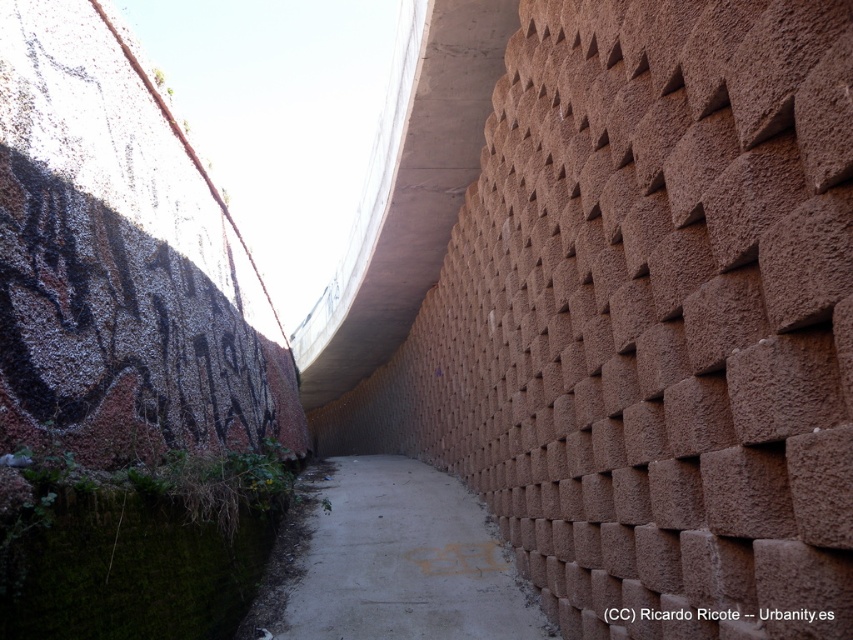
You are standing in the alleyway and want to identify the material of the wall at the point labeled as point [407,189]. Based on the scene description, what material is present at this location?

The point [407,189] indicates concrete at upper center, so the material at that location is concrete.

You are standing in the alleyway and want to move from the point at coordinates (416, 301) to the point at (384, 464). Which direction should you face to walk towards the second point?

You should face towards the direction of point (384, 464), which is behind point (416, 301). Since point (416, 301) is in front of point (384, 464), you need to walk backwards or turn around to move towards the second point.